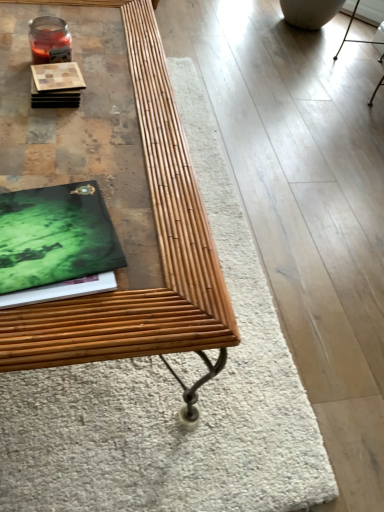
At what (x,y) coordinates should I click in order to perform the action: click on free space in front of wooden coaster at upper left. Please return your answer as a coordinate pair (x, y). Looking at the image, I should click on (54, 136).